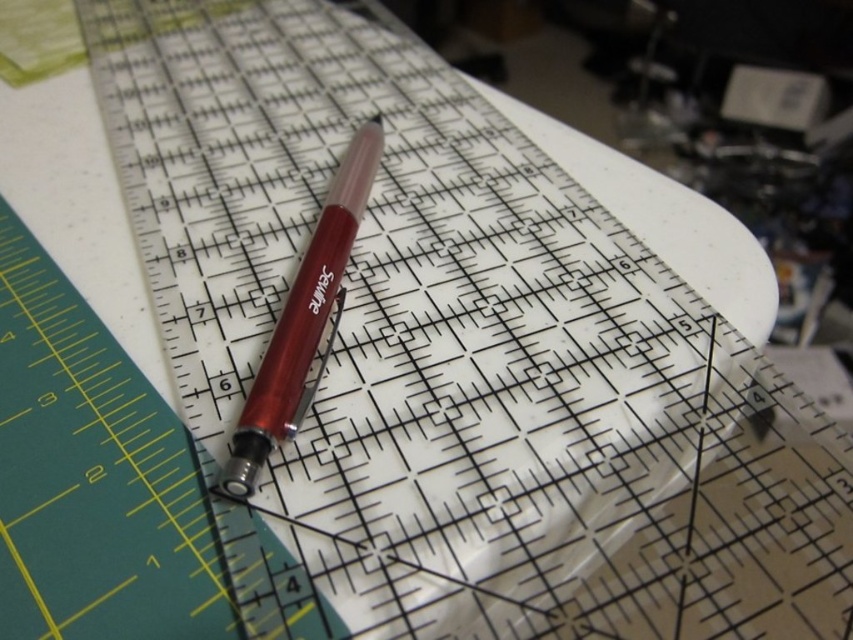
Can you confirm if translucent plastic ruler at upper center is shorter than metallic red pen at center?

Correct, translucent plastic ruler at upper center is not as tall as metallic red pen at center.

Does translucent plastic ruler at upper center have a lesser width compared to metallic red pen at center?

No, translucent plastic ruler at upper center is not thinner than metallic red pen at center.

What do you see at coordinates (115, 490) in the screenshot? I see `translucent plastic ruler at upper center` at bounding box center [115, 490].

Where is `translucent plastic ruler at upper center`? translucent plastic ruler at upper center is located at coordinates (115, 490).